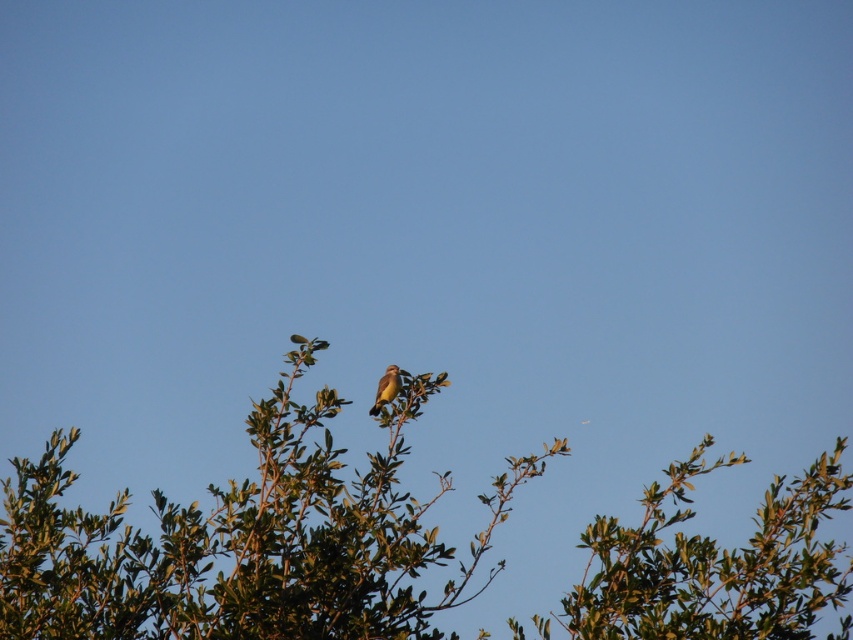
Is green leafy tree at center smaller than yellowish-brown feathers at center?

Actually, green leafy tree at center might be larger than yellowish-brown feathers at center.

Is point (300, 424) closer to camera compared to point (387, 381)?

Yes, point (300, 424) is closer to viewer.

Is point (305, 454) less distant than point (389, 392)?

Yes, point (305, 454) is closer to viewer.

The height and width of the screenshot is (640, 853). In order to click on green leafy tree at center in this screenshot , I will do `click(244, 540)`.